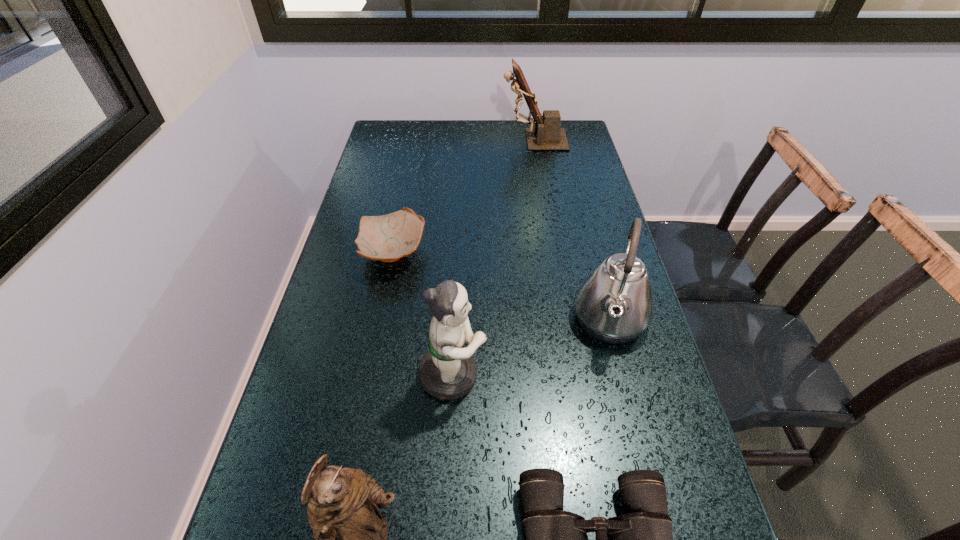
This screenshot has height=540, width=960. I want to click on empty location between the kettle and the farthest figurine, so click(571, 231).

The image size is (960, 540). I want to click on vacant region between the farthest figurine and the pottery, so click(464, 197).

Locate an element on the screen. unoccupied area between the rightmost figurine and the pottery is located at coordinates (464, 197).

Where is `vacant space in between the kettle and the second farthest figurine`? This screenshot has height=540, width=960. vacant space in between the kettle and the second farthest figurine is located at coordinates (531, 348).

The image size is (960, 540). In order to click on free space between the kettle and the second farthest figurine in this screenshot , I will do `click(531, 348)`.

Where is `blank region between the kettle and the rightmost figurine`? Image resolution: width=960 pixels, height=540 pixels. blank region between the kettle and the rightmost figurine is located at coordinates (571, 231).

Find the location of a particular element. The width and height of the screenshot is (960, 540). object that can be found as the third closest to the kettle is located at coordinates (387, 238).

Where is `object identified as the fifth closest to the nearest figurine`? The height and width of the screenshot is (540, 960). object identified as the fifth closest to the nearest figurine is located at coordinates (547, 135).

Locate which figurine is the second closest to the fifth nearest object. Please provide its 2D coordinates. Your answer should be formatted as a tuple, i.e. [(x, y)], where the tuple contains the x and y coordinates of a point satisfying the conditions above.

[(547, 135)]

The width and height of the screenshot is (960, 540). Find the location of `the second closest figurine relative to the second nearest figurine`. the second closest figurine relative to the second nearest figurine is located at coordinates (547, 135).